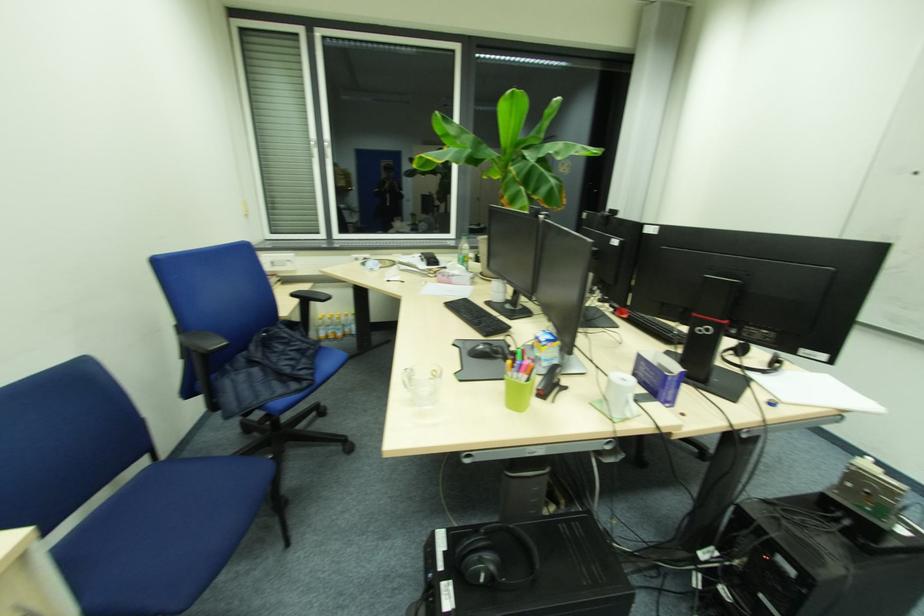
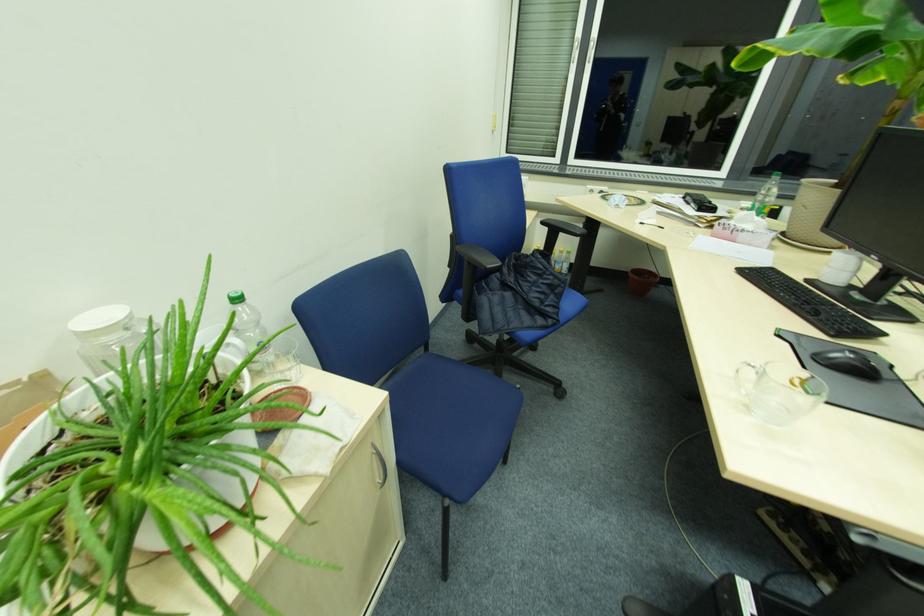
Question: The first image is from the beginning of the video and the second image is from the end. How did the camera likely rotate when shooting the video?

Choices:
 (A) Left
 (B) Right
 (C) Up
 (D) Down

Answer: (A)